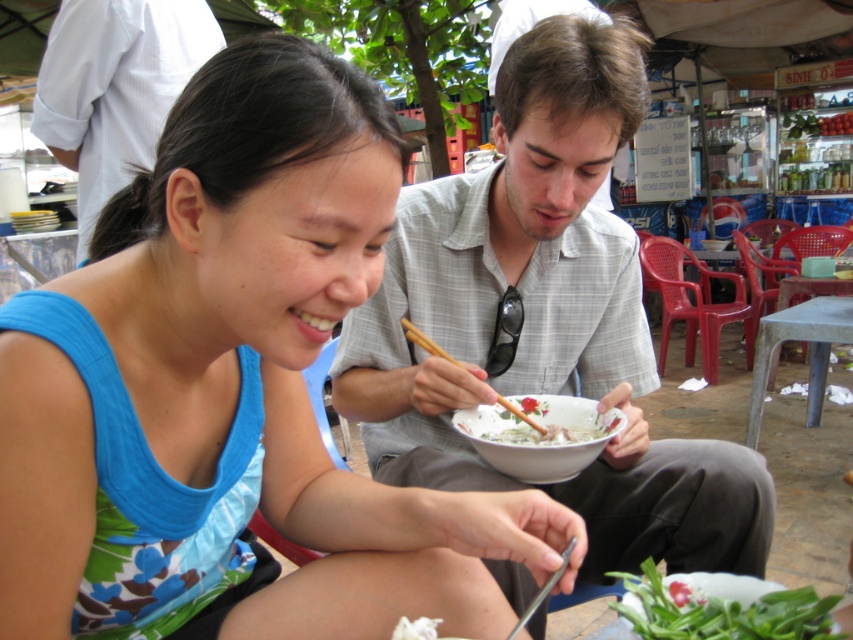
Question: Does light gray plaid shirt at center appear under white shirt at upper left?

Choices:
 (A) yes
 (B) no

Answer: (A)

Question: Estimate the real-world distances between objects in this image. Which object is farther from the light gray plaid shirt at center?

Choices:
 (A) blue fabric tank top at center
 (B) wooden chopsticks at upper center
 (C) wooden chopsticks at lower center

Answer: (C)

Question: Is white shirt at upper left above wooden chopsticks at upper center?

Choices:
 (A) yes
 (B) no

Answer: (A)

Question: Can you confirm if wooden chopsticks at upper center is positioned to the left of wooden chopsticks at lower center?

Choices:
 (A) no
 (B) yes

Answer: (B)

Question: Which point is closer to the camera?

Choices:
 (A) (573, 424)
 (B) (579, 100)
 (C) (88, 480)
 (D) (616, 602)

Answer: (C)

Question: Which point is closer to the camera?

Choices:
 (A) (544, 586)
 (B) (810, 605)
 (C) (408, 253)

Answer: (B)